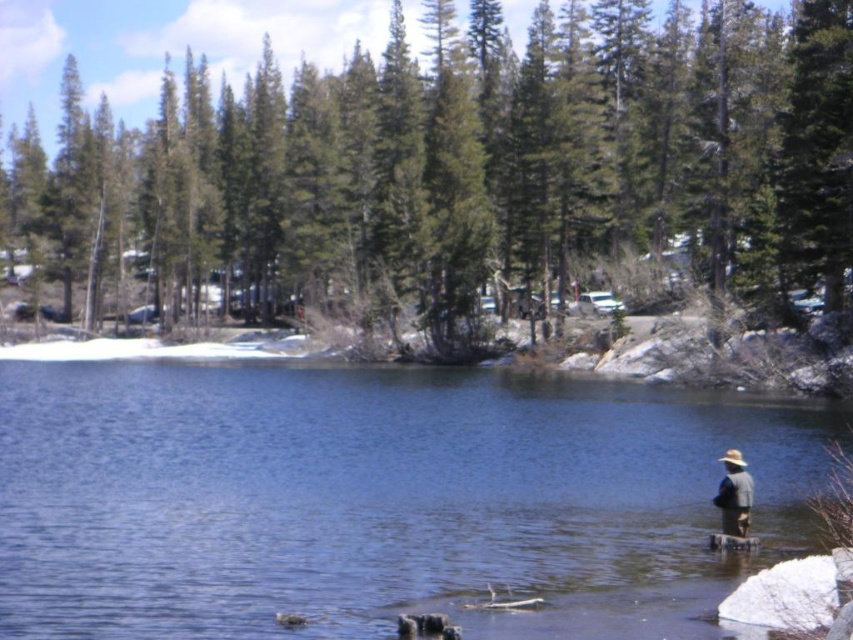
Question: Can you confirm if blue water at center is positioned to the right of gray fabric hat at lower right?

Choices:
 (A) yes
 (B) no

Answer: (B)

Question: Which object is the farthest from the gray fabric hat at lower right?

Choices:
 (A) green textured pine trees at upper center
 (B) blue water at center

Answer: (A)

Question: Which of these objects is positioned closest to the gray fabric hat at lower right?

Choices:
 (A) green textured pine trees at upper center
 (B) blue water at center

Answer: (B)

Question: Which point is farther from the camera taking this photo?

Choices:
 (A) (735, 16)
 (B) (518, 449)
 (C) (724, 458)

Answer: (A)

Question: Does blue water at center have a lesser width compared to gray fabric hat at lower right?

Choices:
 (A) no
 (B) yes

Answer: (A)

Question: From the image, what is the correct spatial relationship of blue water at center in relation to gray fabric hat at lower right?

Choices:
 (A) above
 (B) below

Answer: (A)